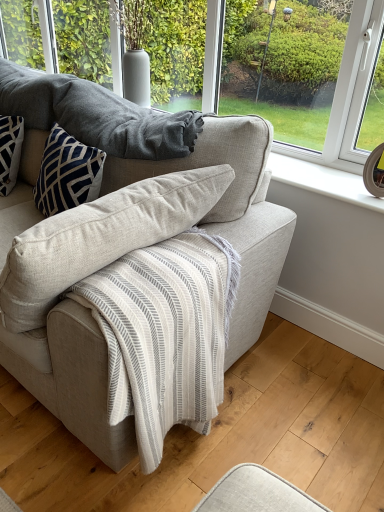
Question: From the image's perspective, is textured wool blanket at upper center over transparent glass window at upper center?

Choices:
 (A) yes
 (B) no

Answer: (B)

Question: From a real-world perspective, is textured wool blanket at upper center located higher than transparent glass window at upper center?

Choices:
 (A) no
 (B) yes

Answer: (A)

Question: Does textured wool blanket at upper center appear on the left side of transparent glass window at upper center?

Choices:
 (A) yes
 (B) no

Answer: (A)

Question: From the image's perspective, does textured wool blanket at upper center appear lower than transparent glass window at upper center?

Choices:
 (A) no
 (B) yes

Answer: (B)

Question: Is textured wool blanket at upper center turned away from transparent glass window at upper center?

Choices:
 (A) no
 (B) yes

Answer: (B)

Question: Is textured wool blanket at upper center taller than transparent glass window at upper center?

Choices:
 (A) yes
 (B) no

Answer: (B)

Question: Considering the relative sizes of transparent glass window at upper center and light beige fabric couch at center in the image provided, is transparent glass window at upper center thinner than light beige fabric couch at center?

Choices:
 (A) no
 (B) yes

Answer: (B)

Question: Does transparent glass window at upper center have a greater width compared to light beige fabric couch at center?

Choices:
 (A) no
 (B) yes

Answer: (A)

Question: Could you tell me if transparent glass window at upper center is facing light beige fabric couch at center?

Choices:
 (A) yes
 (B) no

Answer: (B)

Question: Considering the relative sizes of transparent glass window at upper center and light beige fabric couch at center in the image provided, is transparent glass window at upper center bigger than light beige fabric couch at center?

Choices:
 (A) yes
 (B) no

Answer: (B)

Question: Is transparent glass window at upper center at the right side of light beige fabric couch at center?

Choices:
 (A) no
 (B) yes

Answer: (B)

Question: Can you confirm if transparent glass window at upper center is positioned to the left of light beige fabric couch at center?

Choices:
 (A) yes
 (B) no

Answer: (B)

Question: Is light beige fabric couch at center at the left side of transparent glass window at upper center?

Choices:
 (A) yes
 (B) no

Answer: (A)